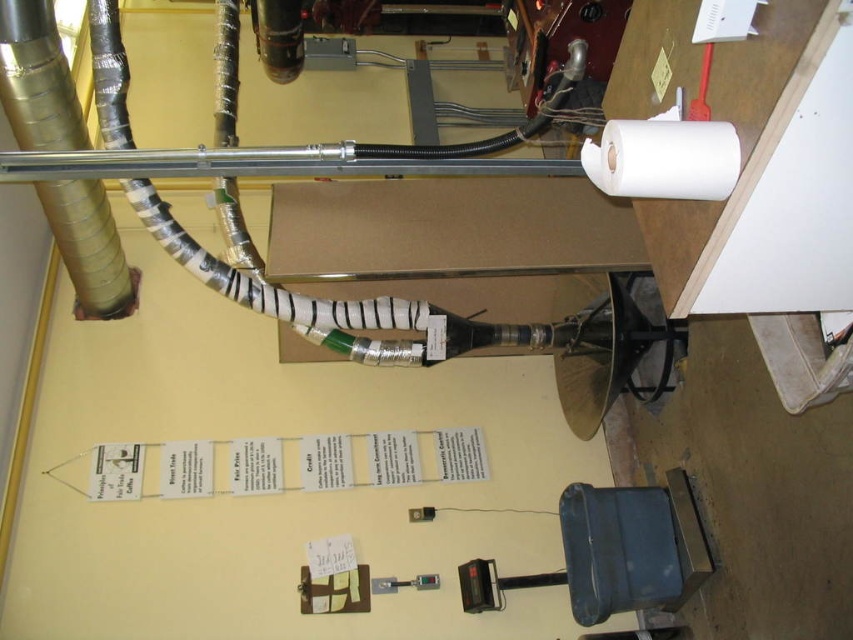
Between gold metallic pipe at left and white matte toilet paper at upper right, which one is positioned lower?

white matte toilet paper at upper right is lower down.

Is gold metallic pipe at left below white matte toilet paper at upper right?

Incorrect, gold metallic pipe at left is not positioned below white matte toilet paper at upper right.

Where is `gold metallic pipe at left`? This screenshot has height=640, width=853. gold metallic pipe at left is located at coordinates (38, 80).